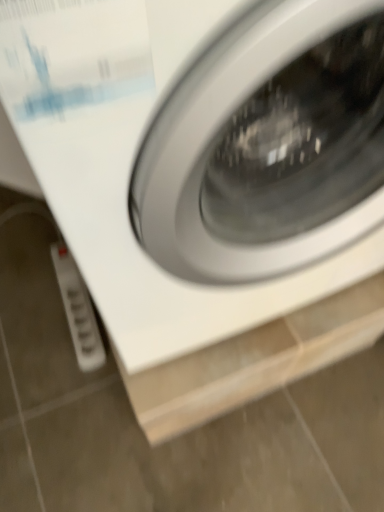
Question: Based on their sizes in the image, would you say white glossy washing machine at center is bigger or smaller than white plastic power strip at lower left?

Choices:
 (A) big
 (B) small

Answer: (A)

Question: In terms of height, does white glossy washing machine at center look taller or shorter compared to white plastic power strip at lower left?

Choices:
 (A) tall
 (B) short

Answer: (A)

Question: Visually, is white glossy washing machine at center positioned to the left or to the right of white plastic power strip at lower left?

Choices:
 (A) right
 (B) left

Answer: (A)

Question: Is point (92, 345) closer or farther from the camera than point (206, 290)?

Choices:
 (A) closer
 (B) farther

Answer: (B)

Question: Relative to white glossy washing machine at center, is white plastic power strip at lower left in front or behind?

Choices:
 (A) front
 (B) behind

Answer: (B)

Question: In terms of size, does white plastic power strip at lower left appear bigger or smaller than white glossy washing machine at center?

Choices:
 (A) small
 (B) big

Answer: (A)

Question: Considering the positions of white plastic power strip at lower left and white glossy washing machine at center in the image, is white plastic power strip at lower left wider or thinner than white glossy washing machine at center?

Choices:
 (A) wide
 (B) thin

Answer: (B)